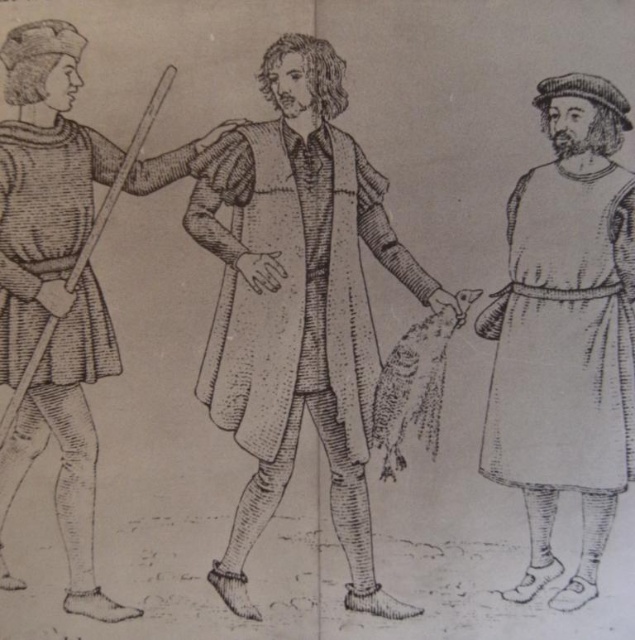
You are standing in front of a medieval illustration and notice two figures wearing smooth brown coat at center and smooth beige tunic at right. Based on their positions, which one is higher up in the image?

The smooth brown coat at center is above the smooth beige tunic at right, so the smooth brown coat at center is higher up in the image.

In the scene shown: You are an observer standing in front of the image. You see the smooth beige tunic at right and the smooth brown robe at center. Which one appears closer to you?

The smooth beige tunic at right appears closer because it is further to the viewer than the smooth brown robe at center.